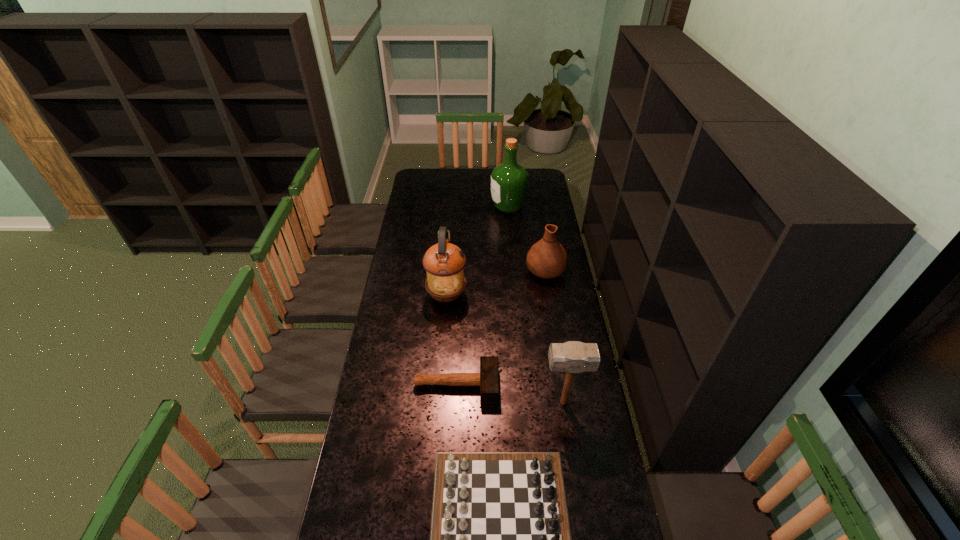
Select which object is the third closest to the taller mallet. Please provide its 2D coordinates. Your answer should be formatted as a tuple, i.e. [(x, y)], where the tuple contains the x and y coordinates of a point satisfying the conditions above.

[(444, 262)]